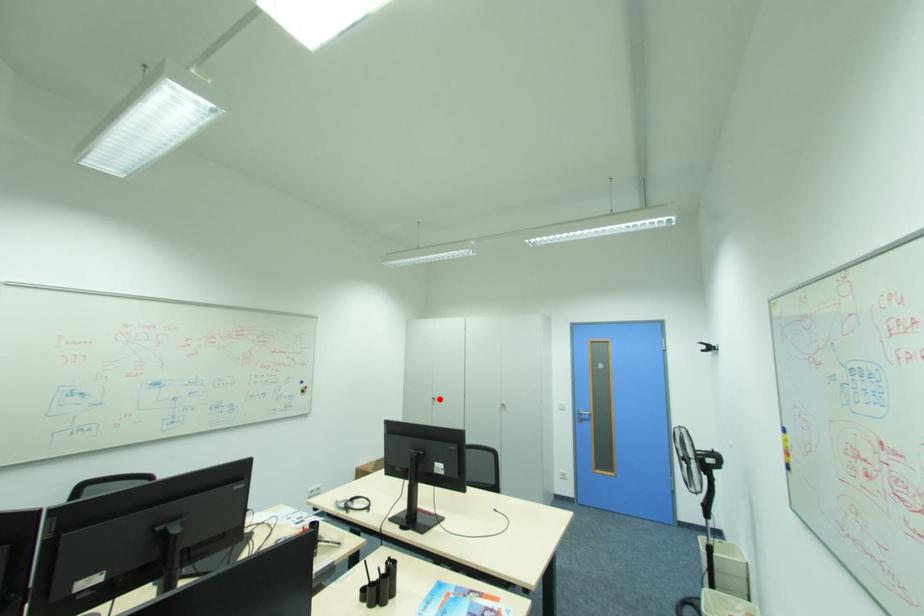
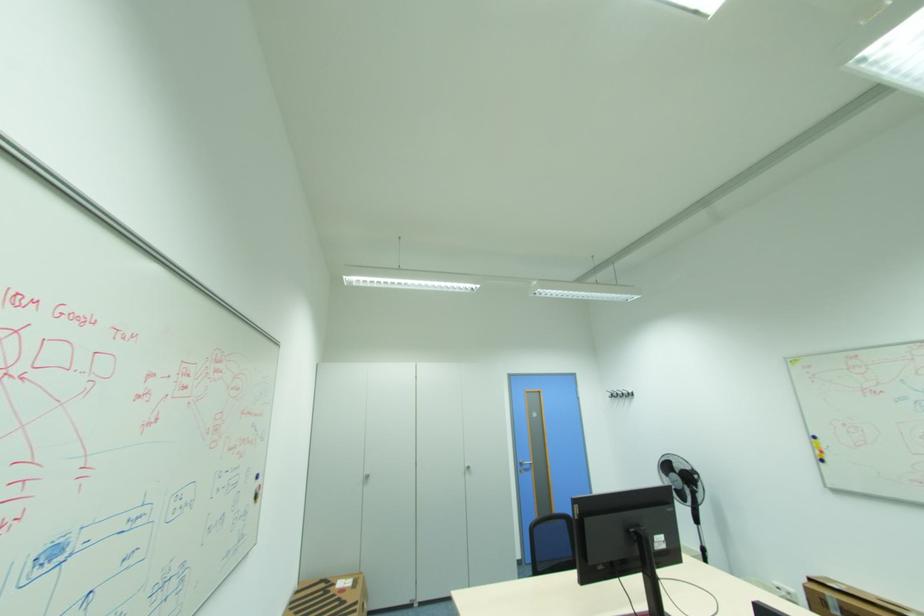
Where in the second image is the point corresponding to the highlighted location from the first image?

(372, 477)